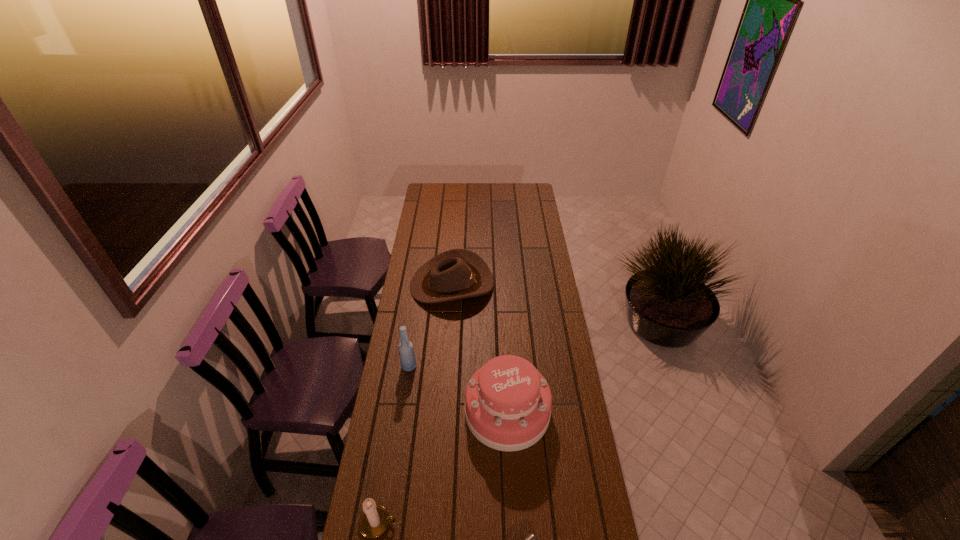
This screenshot has height=540, width=960. Identify the location of the fourth nearest object. (406, 350).

At what (x,y) coordinates should I click in order to perform the action: click on the third farthest object. Please return your answer as a coordinate pair (x, y). Looking at the image, I should click on (508, 402).

The height and width of the screenshot is (540, 960). I want to click on the farthest object, so click(x=457, y=273).

Identify the location of candle holder. Image resolution: width=960 pixels, height=540 pixels. [374, 520].

Locate an element on the screen. The image size is (960, 540). free location located on the back of the bottle is located at coordinates (415, 326).

Locate an element on the screen. free space located 0.090m on the front of the third nearest object is located at coordinates (511, 479).

Where is `vacant point located with a star on the front of the farthest object`? vacant point located with a star on the front of the farthest object is located at coordinates (523, 284).

Where is `vacant space situated 0.340m on the handle side of the candle holder`? vacant space situated 0.340m on the handle side of the candle holder is located at coordinates (511, 523).

What are the coordinates of `bottle at the left edge` in the screenshot? It's located at (406, 350).

This screenshot has height=540, width=960. What are the coordinates of `cowboy hat located in the left edge section of the desktop` in the screenshot? It's located at (457, 273).